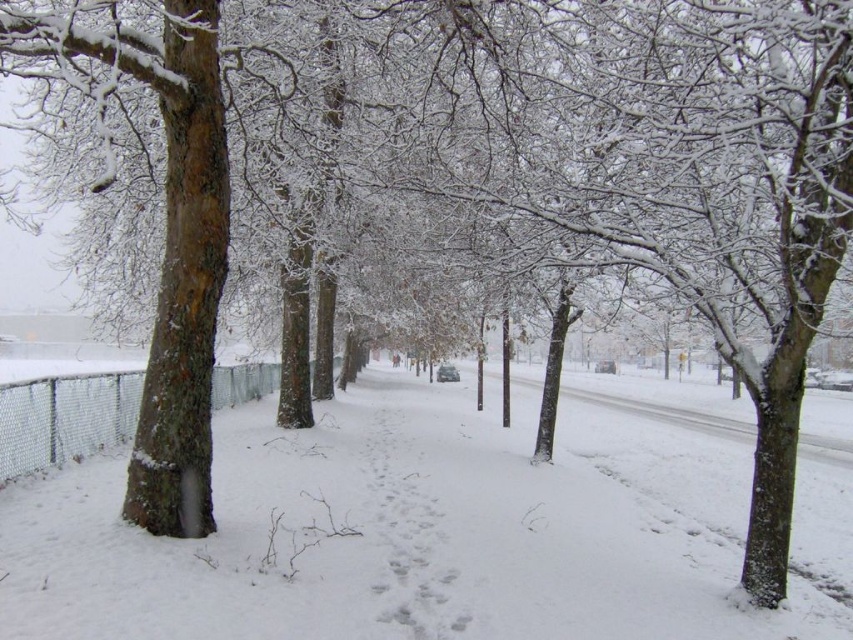
You are a delivery person trying to park your vehicle in the snow. You need to know if the white snow pavement at center is wide enough to accommodate your vehicle, which is 2 meters wide. Can you fit your vehicle there? Please consider the metal mesh fence at left in your assessment.

The white snow pavement at center is wider than the metal mesh fence at left, so it should be wide enough to fit a vehicle that is 2 meters wide.